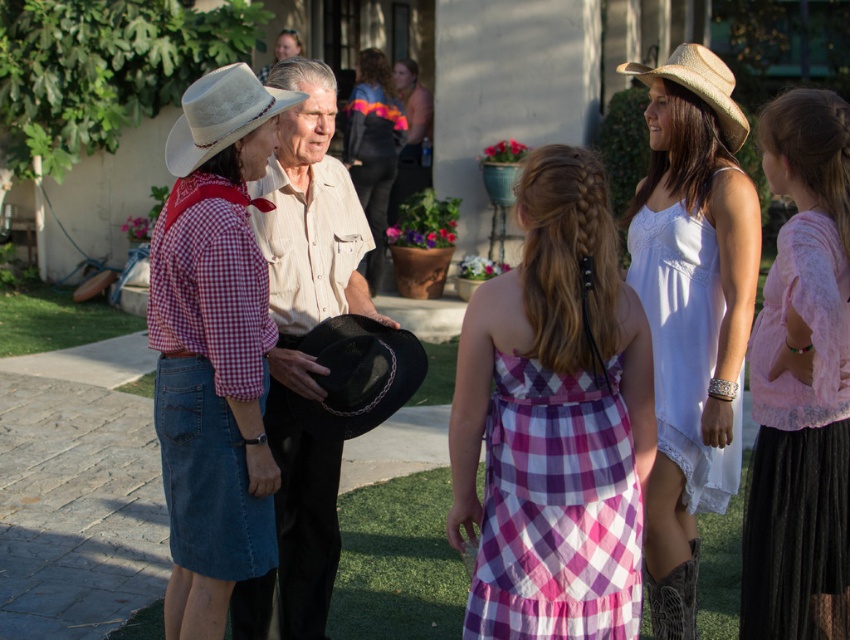
Question: Can you confirm if pink lace blouse at center is positioned to the right of white lace dress at center?

Choices:
 (A) no
 (B) yes

Answer: (B)

Question: Can you confirm if pink lace blouse at center is wider than multicolored fabric sweater at center?

Choices:
 (A) no
 (B) yes

Answer: (A)

Question: Estimate the real-world distances between objects in this image. Which object is closer to the pink lace blouse at center?

Choices:
 (A) matte pink tank top at center
 (B) multicolored fabric sweater at center

Answer: (B)

Question: Which object appears farthest from the camera in this image?

Choices:
 (A) white cotton dress at upper right
 (B) multicolored fabric sweater at center
 (C) white woven cowboy hat at center

Answer: (B)

Question: Which point is farther from the camera taking this photo?

Choices:
 (A) (650, 304)
 (B) (225, 412)

Answer: (A)

Question: Does pink lace blouse at center lie in front of matte pink tank top at center?

Choices:
 (A) no
 (B) yes

Answer: (B)